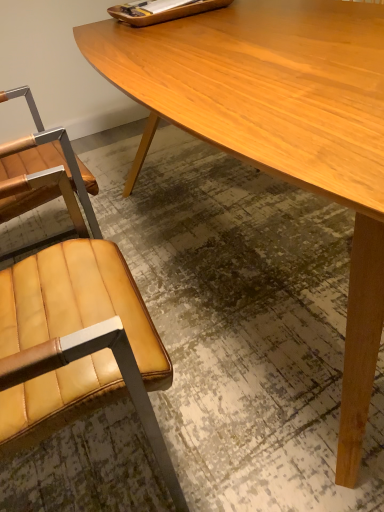
Image resolution: width=384 pixels, height=512 pixels. In order to click on free point to the right of leather at left in this screenshot , I will do `click(252, 391)`.